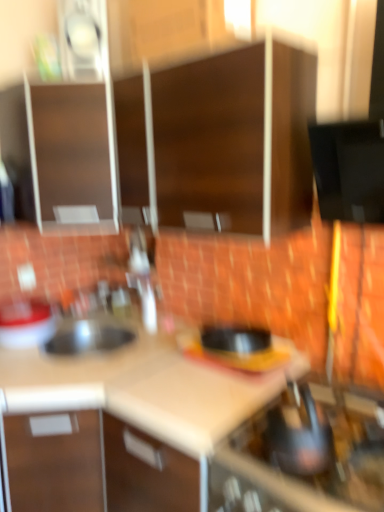
Question: Should I look upward or downward to see beige laminate counter top at center, marked as the 1th counter top in a right-to-left arrangement?

Choices:
 (A) down
 (B) up

Answer: (A)

Question: From the image's perspective, does matte brown cabinet at upper left, the 1th cabinetry when ordered from left to right, appear lower than metallic silver kettle at lower right?

Choices:
 (A) yes
 (B) no

Answer: (B)

Question: Can you confirm if matte brown cabinet at upper left, which appears as the third cabinetry when viewed from the right, is shorter than metallic silver kettle at lower right?

Choices:
 (A) no
 (B) yes

Answer: (A)

Question: Can you confirm if matte brown cabinet at upper left, which appears as the third cabinetry when viewed from the right, is smaller than metallic silver kettle at lower right?

Choices:
 (A) yes
 (B) no

Answer: (B)

Question: Is matte brown cabinet at upper left, which appears as the third cabinetry when viewed from the right, positioned with its back to metallic silver kettle at lower right?

Choices:
 (A) yes
 (B) no

Answer: (B)

Question: From a real-world perspective, is matte brown cabinet at upper left, the 1th cabinetry when ordered from left to right, on top of metallic silver kettle at lower right?

Choices:
 (A) yes
 (B) no

Answer: (A)

Question: From a real-world perspective, is matte brown cabinet at upper left, which appears as the third cabinetry when viewed from the right, under metallic silver kettle at lower right?

Choices:
 (A) no
 (B) yes

Answer: (A)

Question: Is white matte countertop at center, which appears as the second counter top when viewed from the right, to the right of matte brown cabinet at upper left, the 1th cabinetry when ordered from left to right, from the viewer's perspective?

Choices:
 (A) no
 (B) yes

Answer: (B)

Question: Does white matte countertop at center, which appears as the second counter top when viewed from the right, have a lesser height compared to matte brown cabinet at upper left, which appears as the third cabinetry when viewed from the right?

Choices:
 (A) yes
 (B) no

Answer: (A)

Question: From the image's perspective, is white matte countertop at center, which appears as the second counter top when viewed from the right, beneath matte brown cabinet at upper left, which appears as the third cabinetry when viewed from the right?

Choices:
 (A) no
 (B) yes

Answer: (B)

Question: Is white matte countertop at center, arranged as the 1th counter top when viewed from the left, far from matte brown cabinet at upper left, which appears as the third cabinetry when viewed from the right?

Choices:
 (A) no
 (B) yes

Answer: (A)

Question: Is white matte countertop at center, arranged as the 1th counter top when viewed from the left, outside of matte brown cabinet at upper left, which appears as the third cabinetry when viewed from the right?

Choices:
 (A) yes
 (B) no

Answer: (A)

Question: Does white matte countertop at center, which appears as the second counter top when viewed from the right, have a larger size compared to matte brown cabinet at upper left, the 1th cabinetry when ordered from left to right?

Choices:
 (A) yes
 (B) no

Answer: (B)

Question: From a real-world perspective, is metallic silver kettle at lower right under wooden cabinet at upper center, acting as the second cabinetry starting from the left?

Choices:
 (A) yes
 (B) no

Answer: (A)